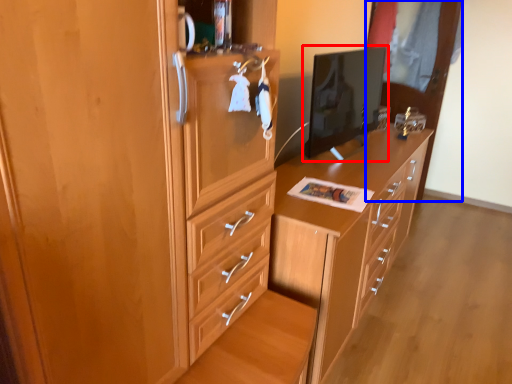
Question: Which object appears closest to the camera in this image, computer monitor (highlighted by a red box) or glass door (highlighted by a blue box)?

Choices:
 (A) computer monitor
 (B) glass door

Answer: (A)